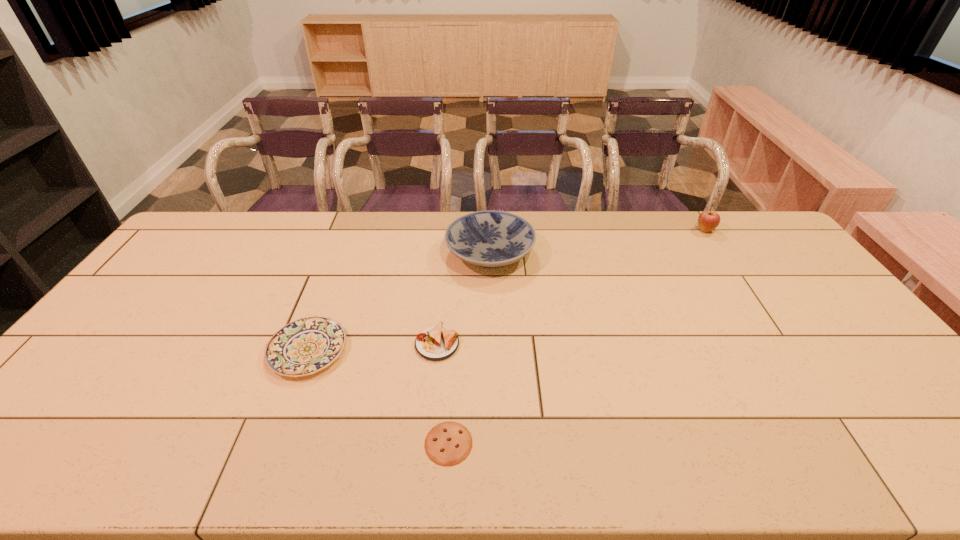
At what (x,y) coordinates should I click in order to perform the action: click on apple. Please return your answer as a coordinate pair (x, y). Looking at the image, I should click on (708, 220).

The width and height of the screenshot is (960, 540). I want to click on the taller plate, so [491, 239].

The width and height of the screenshot is (960, 540). Identify the location of the right plate. (491, 239).

You are a GUI agent. You are given a task and a screenshot of the screen. Output one action in this format:
    pyautogui.click(x=<x>, y=<y>)
    Task: Click on the sandwich
    Image resolution: width=960 pixels, height=540 pixels.
    Given the screenshot: What is the action you would take?
    pyautogui.click(x=435, y=343)

What are the coordinates of `the second shortest object` in the screenshot? It's located at (305, 346).

Where is `the shorter plate`? the shorter plate is located at coordinates (305, 346).

The width and height of the screenshot is (960, 540). I want to click on the nearest object, so click(x=449, y=443).

You are a GUI agent. You are given a task and a screenshot of the screen. Output one action in this format:
    pyautogui.click(x=<x>, y=<y>)
    Task: Click on the shortest object
    
    Given the screenshot: What is the action you would take?
    pyautogui.click(x=449, y=443)

In order to click on free region located on the left of the rightmost object in this screenshot , I will do `click(662, 230)`.

Find the location of a particular element. vacant space located on the left of the farther plate is located at coordinates (405, 253).